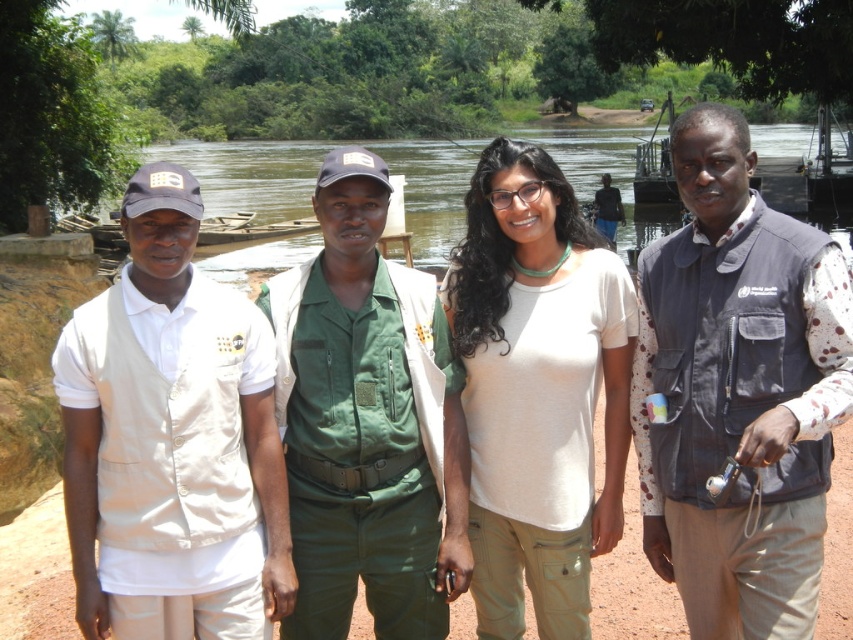
You are standing at point (267, 376) and want to walk to point (817, 419). Which direction should you move relative to your current position?

You should move forward because point (817, 419) is in front of point (267, 376).

Based on the scene description, where is the dark gray vest at right located in terms of its 2D coordinates?

The dark gray vest at right is located at the 2D coordinates point (738,390).

You are trying to identify the positions of two people in the group based on their vests. The beige fabric vest at left and the dark gray vest at right are both visible. Which vest is positioned to the right of the other?

The dark gray vest at right is positioned to the right of the beige fabric vest at left.